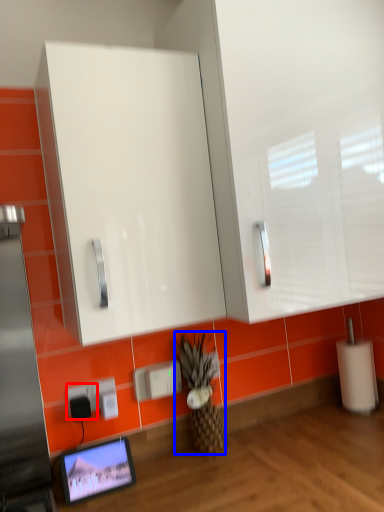
Question: Which of the following is the closest to the observer, electric outlet (highlighted by a red box) or pineapple (highlighted by a blue box)?

Choices:
 (A) electric outlet
 (B) pineapple

Answer: (A)